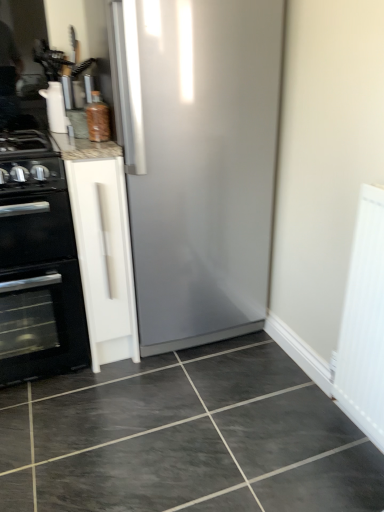
Question: Is point (48, 83) closer or farther from the camera than point (0, 148)?

Choices:
 (A) farther
 (B) closer

Answer: (A)

Question: From the image's perspective, is white glossy paper towel dispenser at upper left above or below black matte gas stove at left?

Choices:
 (A) above
 (B) below

Answer: (A)

Question: Which object is positioned farthest from the white glossy paper towel dispenser at upper left?

Choices:
 (A) black matte gas stove at left
 (B) dark gray glossy tile at center
 (C) black matte oven at left
 (D) white matte cabinet at left
 (E) white textured radiator at right

Answer: (E)

Question: Which object is positioned closest to the black matte gas stove at left?

Choices:
 (A) dark gray glossy tile at center
 (B) white glossy paper towel dispenser at upper left
 (C) black matte oven at left
 (D) white matte cabinet at left
 (E) white textured radiator at right

Answer: (C)